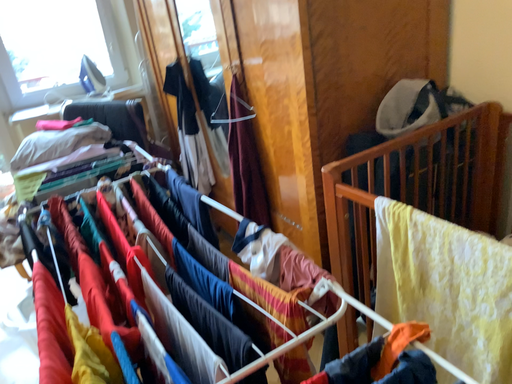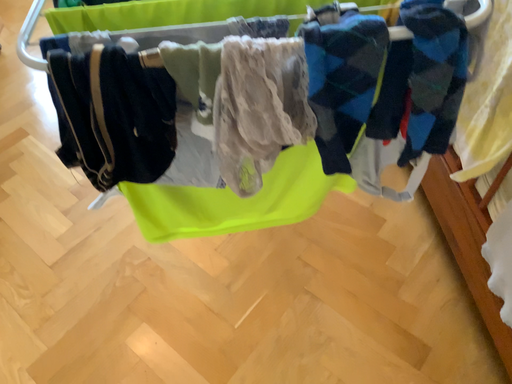
Question: How did the camera likely rotate when shooting the video?

Choices:
 (A) rotated left
 (B) rotated right

Answer: (A)